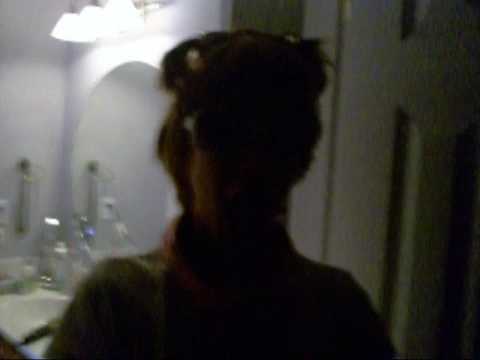
This screenshot has width=480, height=360. I want to click on mirror, so click(29, 90).